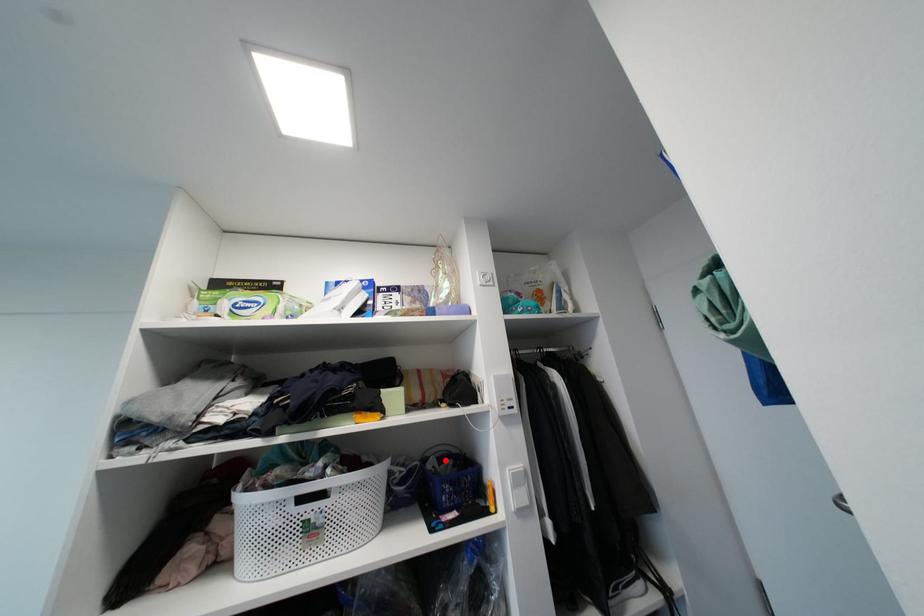
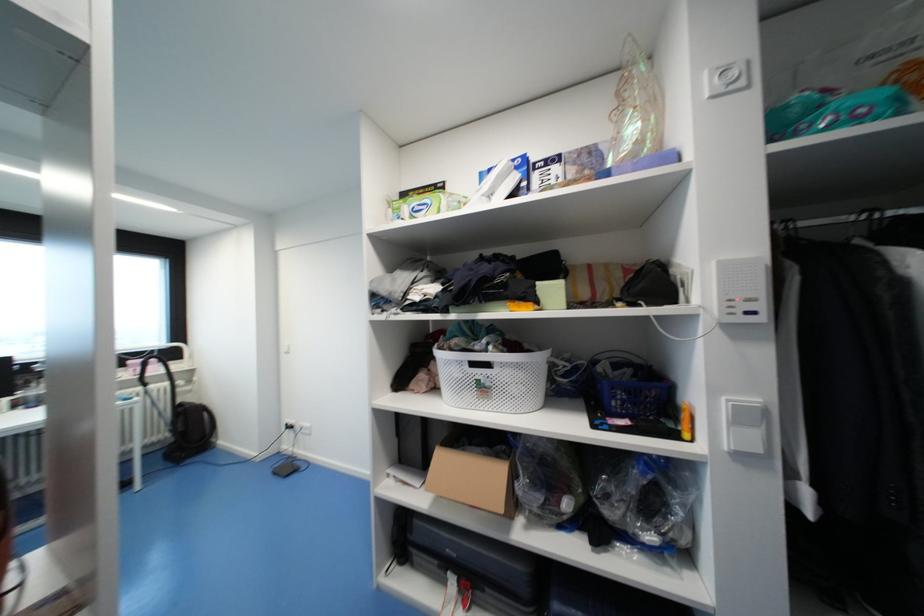
The point at the highlighted location is marked in the first image. Where is the corresponding point in the second image?

(621, 367)